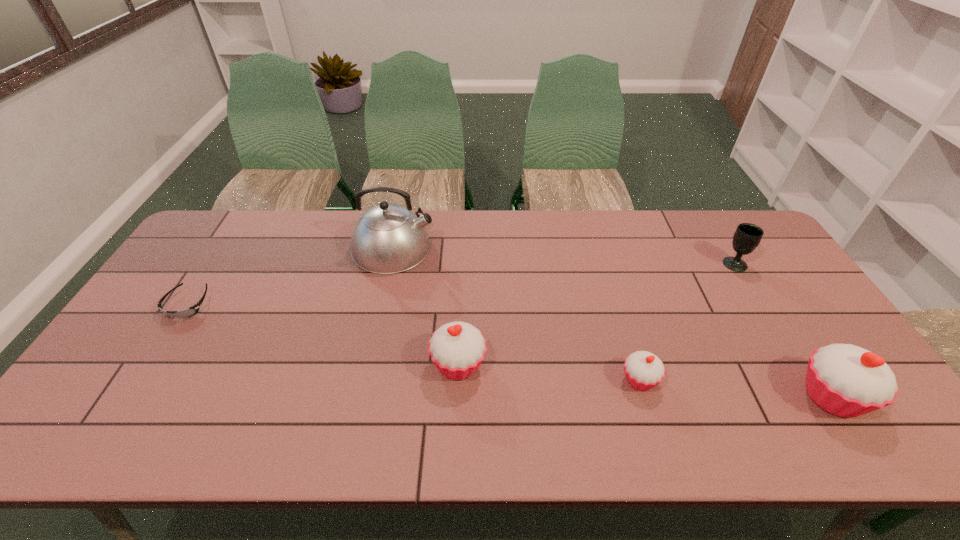
You are a GUI agent. You are given a task and a screenshot of the screen. Output one action in this format:
    pyautogui.click(x=<x>, y=<y>)
    Task: Click on the vacant area situated 0.290m on the back of the leftmost cupcake
    The width and height of the screenshot is (960, 540).
    Given the screenshot: What is the action you would take?
    pyautogui.click(x=463, y=268)

Locate an element on the screen. The height and width of the screenshot is (540, 960). vacant area situated on the back of the fifth tallest object is located at coordinates (605, 266).

I want to click on free space located on the left of the rightmost cupcake, so click(x=684, y=396).

Image resolution: width=960 pixels, height=540 pixels. Find the location of `free point located 0.120m on the lenses of the fourth nearest object`. free point located 0.120m on the lenses of the fourth nearest object is located at coordinates (155, 356).

At what (x,y) coordinates should I click in order to perform the action: click on blank space located 0.380m from the spout of the fifth object from right to left. Please return your answer as a coordinate pair (x, y). Image resolution: width=960 pixels, height=540 pixels. Looking at the image, I should click on (549, 247).

At what (x,y) coordinates should I click in order to perform the action: click on vacant area located on the left of the chalice. Please return your answer as a coordinate pair (x, y). This screenshot has width=960, height=540. Looking at the image, I should click on (638, 264).

Identify the location of object present at the far edge. (388, 238).

In order to click on object that is at the left edge in this screenshot , I will do `click(191, 311)`.

The height and width of the screenshot is (540, 960). Identify the location of cupcake present at the right edge. (846, 380).

Image resolution: width=960 pixels, height=540 pixels. I want to click on chalice located in the right edge section of the desktop, so click(747, 237).